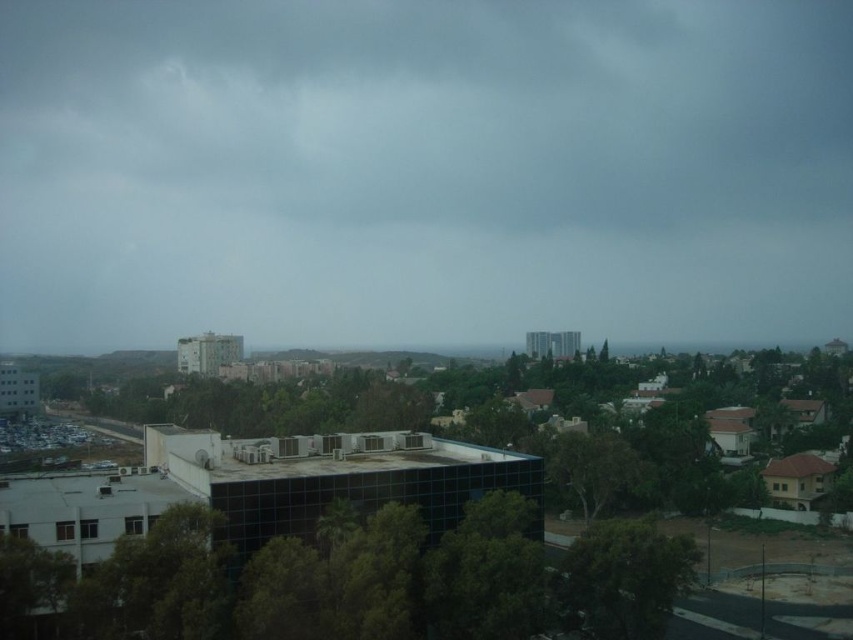
Question: Among these points, which one is farthest from the camera?

Choices:
 (A) (846, 160)
 (B) (401, 602)

Answer: (A)

Question: Where is dark gray cloud at upper center located in relation to green leafy tree at lower right in the image?

Choices:
 (A) right
 (B) left

Answer: (B)

Question: Which is nearer to the green leafy tree at center?

Choices:
 (A) dark gray cloud at upper center
 (B) green leafy tree at lower right

Answer: (B)

Question: Which point is farther to the camera?

Choices:
 (A) green leafy tree at lower right
 (B) green leafy tree at center

Answer: (A)

Question: Is green leafy tree at center to the right of green leafy tree at lower right from the viewer's perspective?

Choices:
 (A) yes
 (B) no

Answer: (B)

Question: Is dark gray cloud at upper center thinner than green leafy tree at lower right?

Choices:
 (A) yes
 (B) no

Answer: (B)